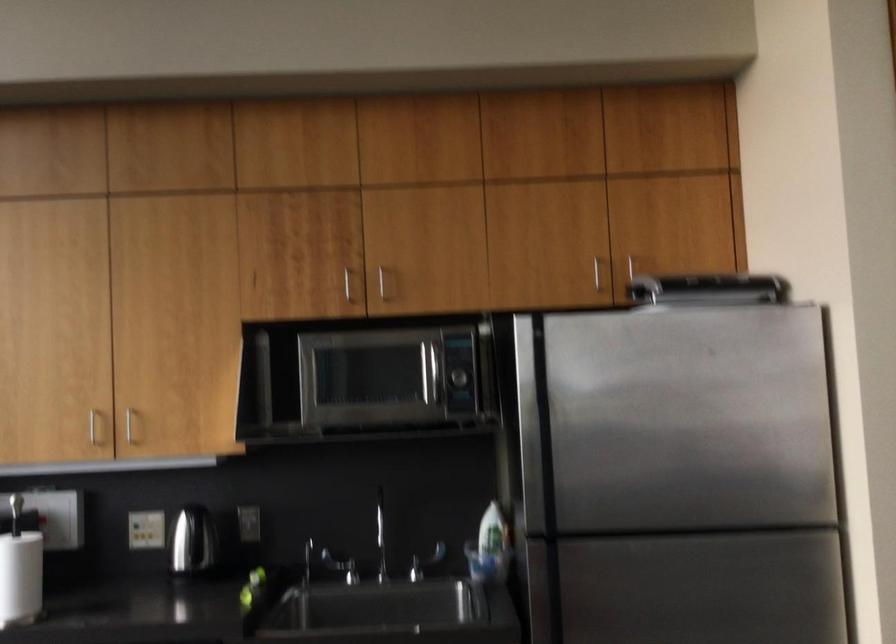
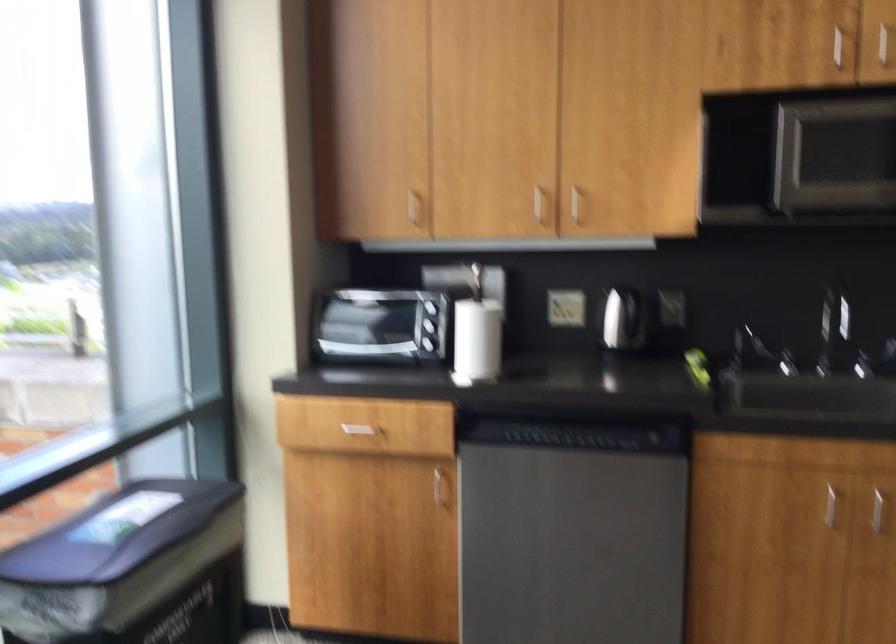
Question: The camera is either moving clockwise (left) or counter-clockwise (right) around the object. The first image is from the beginning of the video and the second image is from the end. Is the camera moving left or right when shooting the video?

Choices:
 (A) Left
 (B) Right

Answer: (B)